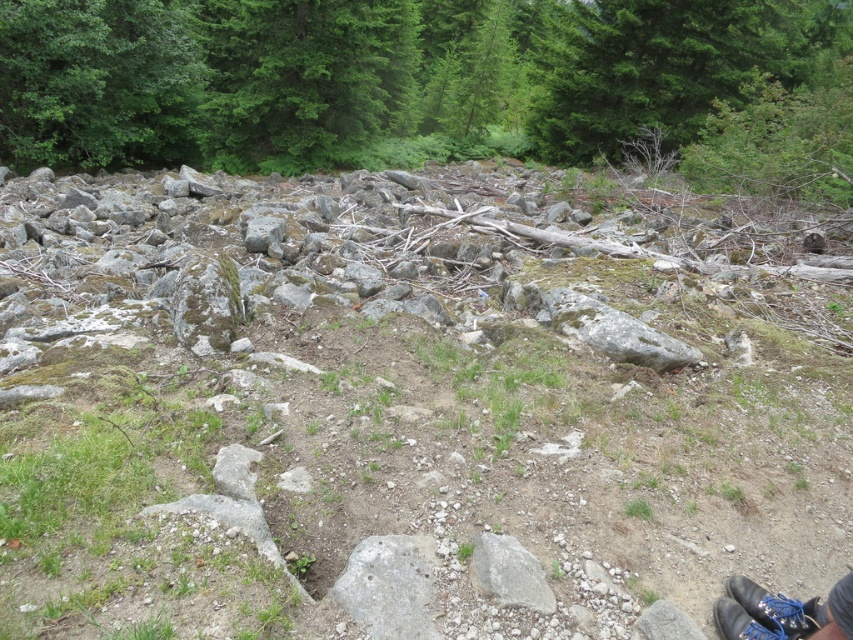
Question: Among these objects, which one is nearest to the camera?

Choices:
 (A) green leafy tree at upper center
 (B) gray rock pile at center

Answer: (B)

Question: Is gray rough rock at center above black leather shoe at lower right?

Choices:
 (A) no
 (B) yes

Answer: (A)

Question: Is green leafy tree at upper center smaller than black leather shoe at lower right?

Choices:
 (A) yes
 (B) no

Answer: (B)

Question: Is gray rough rock at center positioned at the back of black leather shoe at lower right?

Choices:
 (A) no
 (B) yes

Answer: (B)

Question: Which point is closer to the camera?

Choices:
 (A) (357, 582)
 (B) (749, 595)
 (C) (103, 22)

Answer: (A)

Question: Estimate the real-world distances between objects in this image. Which object is closer to the black leather shoe at lower right?

Choices:
 (A) green leafy tree at upper center
 (B) gray rock pile at center

Answer: (B)